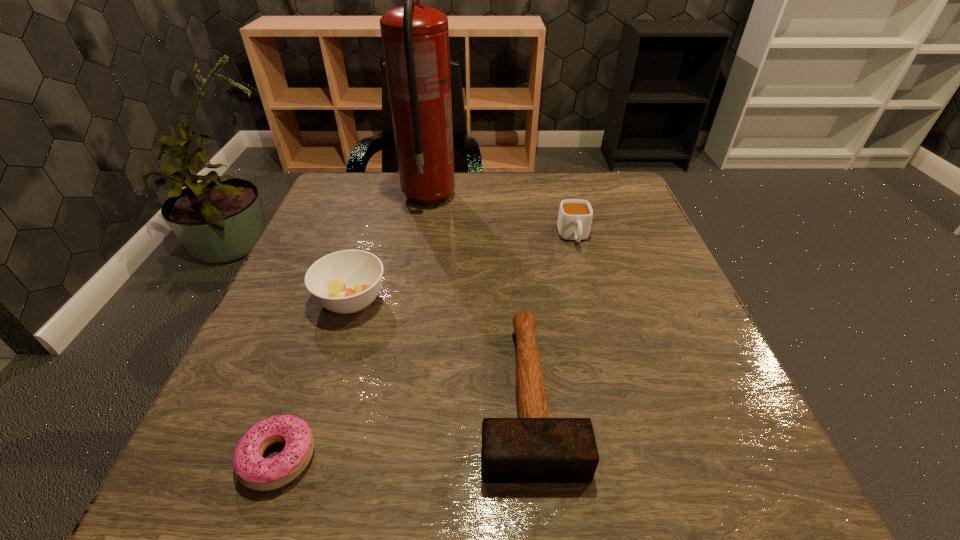
Locate an element on the screen. The height and width of the screenshot is (540, 960). free space between the soup bowl and the rightmost object is located at coordinates (463, 269).

Locate an element on the screen. empty space between the fourth object from left to right and the tallest object is located at coordinates (479, 295).

You are a GUI agent. You are given a task and a screenshot of the screen. Output one action in this format:
    pyautogui.click(x=<x>, y=<y>)
    Task: Click on the free space between the mallet and the fire extinguisher
    
    Given the screenshot: What is the action you would take?
    pyautogui.click(x=479, y=295)

Where is `vacant region between the shortest object and the tallest object`? The width and height of the screenshot is (960, 540). vacant region between the shortest object and the tallest object is located at coordinates (353, 327).

The width and height of the screenshot is (960, 540). What are the coordinates of `unoccupied area between the second object from right to left and the farthest object` in the screenshot? It's located at (479, 295).

Identify the location of object identified as the third closest to the soup bowl. (415, 38).

Identify the location of the third closest object to the cup. The width and height of the screenshot is (960, 540). (347, 281).